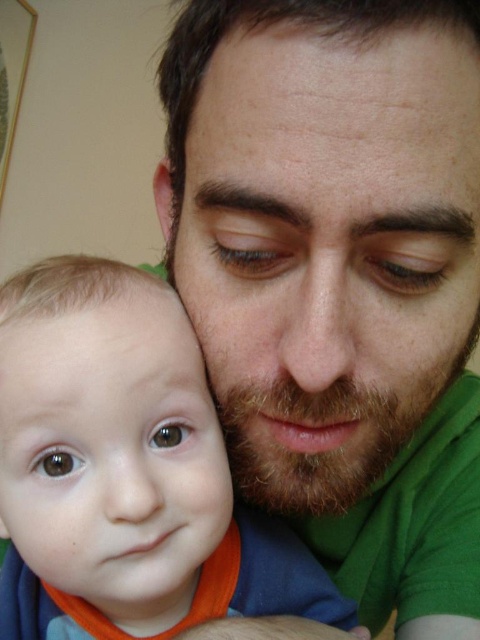
Question: Which is nearer to the smooth orange bib at lower left?

Choices:
 (A) smooth skin forehead at upper center
 (B) green matte shirt at center

Answer: (B)

Question: Considering the real-world distances, which object is farthest from the green matte shirt at center?

Choices:
 (A) smooth orange bib at lower left
 (B) smooth skin forehead at upper center

Answer: (B)

Question: Which point is farther from the camera taking this photo?

Choices:
 (A) (359, 1)
 (B) (103, 497)
 (C) (280, 80)

Answer: (B)

Question: Can you confirm if smooth orange bib at lower left is bigger than smooth skin forehead at upper center?

Choices:
 (A) no
 (B) yes

Answer: (B)

Question: Does smooth orange bib at lower left have a greater width compared to smooth skin forehead at upper center?

Choices:
 (A) yes
 (B) no

Answer: (A)

Question: Can you confirm if green matte shirt at center is positioned above smooth skin forehead at upper center?

Choices:
 (A) no
 (B) yes

Answer: (A)